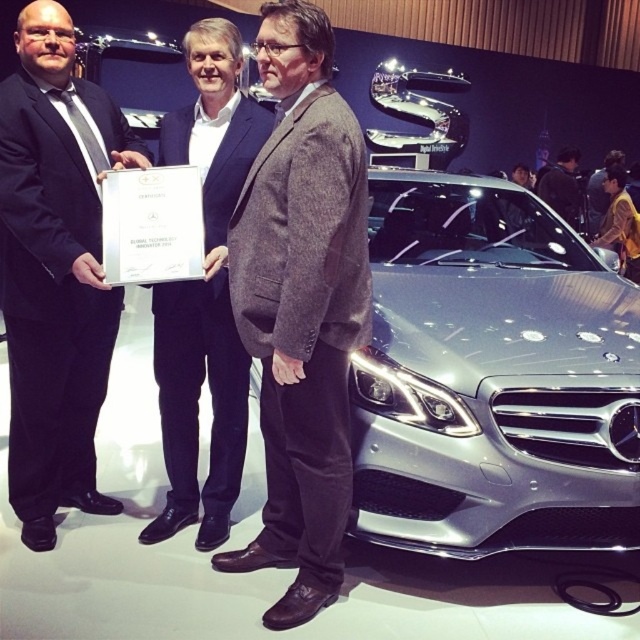
Does sleek metallic car at center appear on the left side of gray woolen blazer at center?

No, sleek metallic car at center is not to the left of gray woolen blazer at center.

Can you confirm if sleek metallic car at center is positioned below gray woolen blazer at center?

No, sleek metallic car at center is not below gray woolen blazer at center.

The image size is (640, 640). Find the location of `sleek metallic car at center`. sleek metallic car at center is located at coordinates (492, 376).

Is dark gray suit at center above yellow fabric shirt at right?

No.

Where is `dark gray suit at center`? The image size is (640, 640). dark gray suit at center is located at coordinates 561,186.

Is point (570, 209) less distant than point (614, 163)?

Yes, it is.

This screenshot has height=640, width=640. Find the location of `dark gray suit at center`. dark gray suit at center is located at coordinates (561, 186).

Is the position of sleek metallic car at center more distant than that of black suit at left?

Yes, it is.

Who is more forward, (435,195) or (1,93)?

Positioned in front is point (1,93).

Where is `sleek metallic car at center`? sleek metallic car at center is located at coordinates (492, 376).